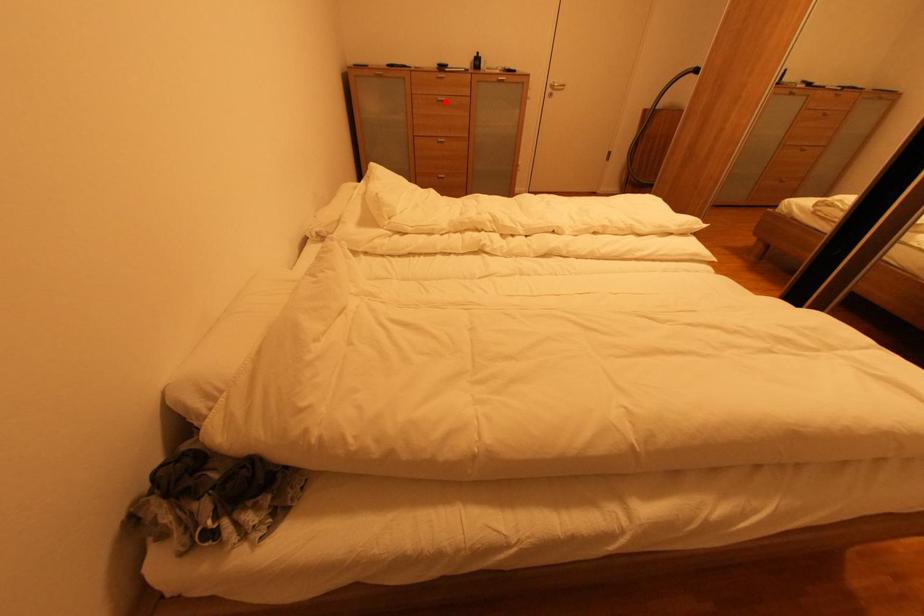
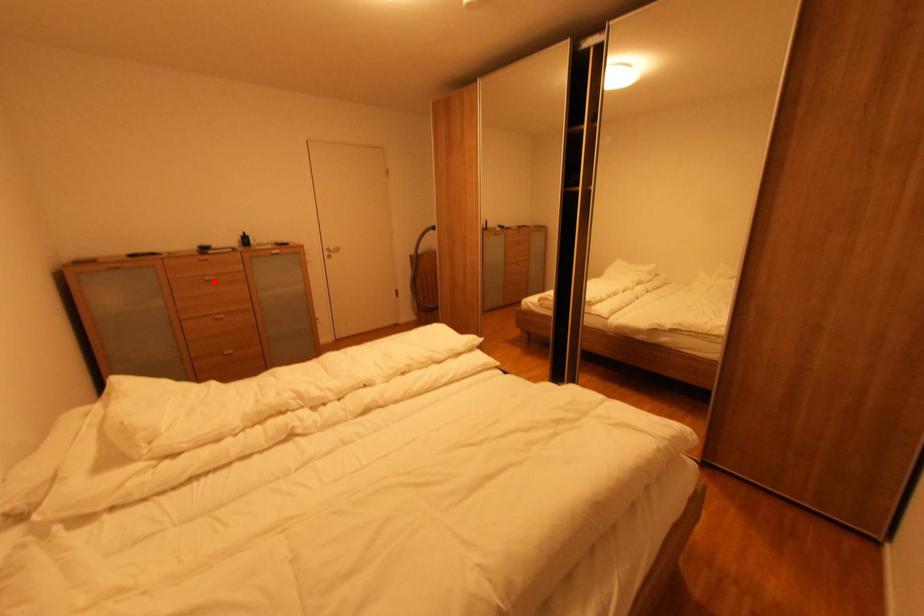
I am providing you with two images of the same scene from different viewpoints. A red point is marked on the first image and another point is marked on the second image. Do the highlighted points in image1 and image2 indicate the same real-world spot?

Yes